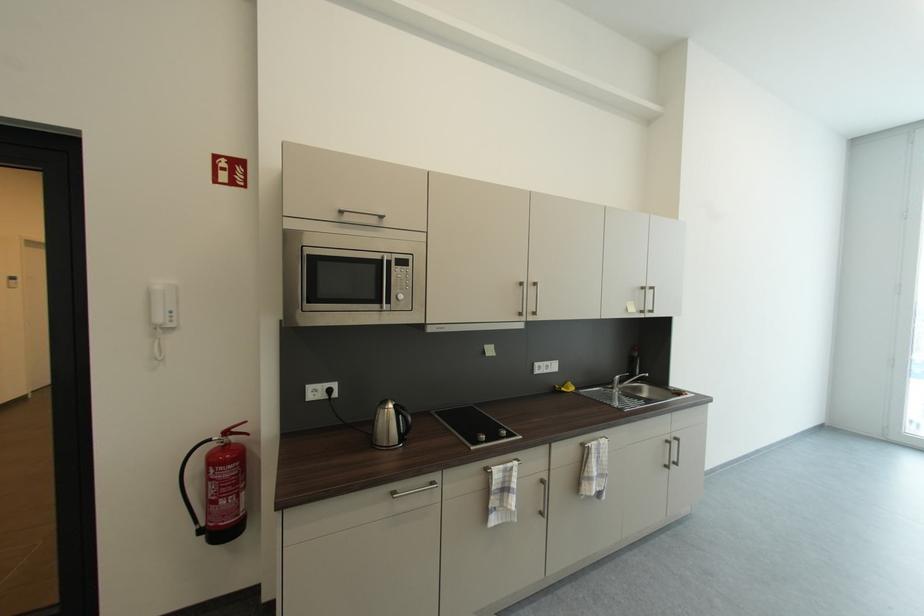
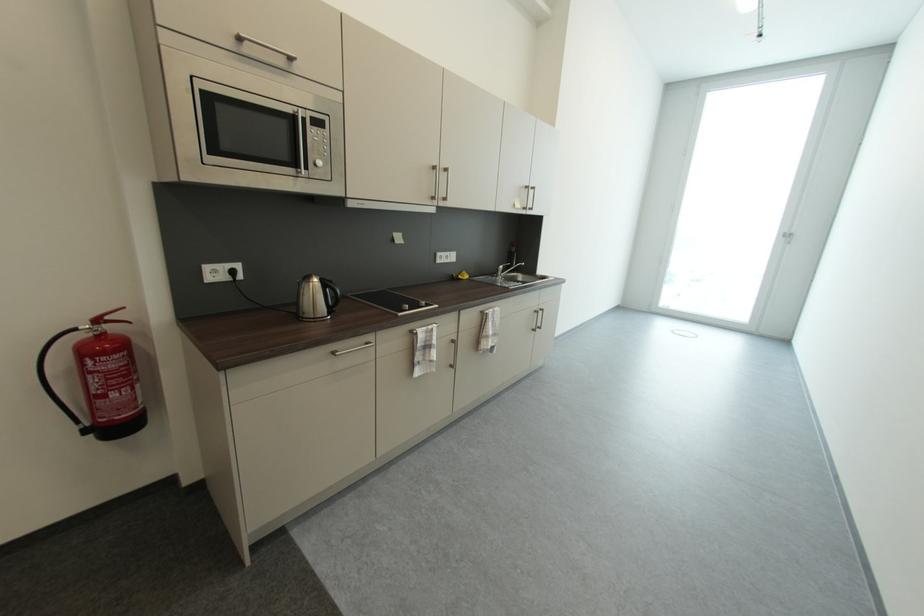
Question: Based on the continuous images, in which direction is the camera rotating? Reply with the corresponding letter.

Choices:
 (A) Left
 (B) Right
 (C) Up
 (D) Down

Answer: (B)